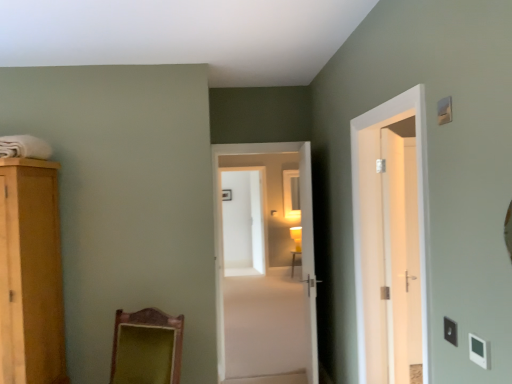
This screenshot has height=384, width=512. Describe the element at coordinates (293, 261) in the screenshot. I see `matte wooden table at center` at that location.

The width and height of the screenshot is (512, 384). I want to click on matte wooden table at center, so click(293, 261).

Describe the element at coordinates (291, 194) in the screenshot. This screenshot has width=512, height=384. I see `matte glass mirror at center` at that location.

You are a GUI agent. You are given a task and a screenshot of the screen. Output one action in this format:
    pyautogui.click(x=<x>, y=<y>)
    Task: Click on the white glossy screen door at center
    Image resolution: width=512 pixels, height=384 pixels.
    Given the screenshot: What is the action you would take?
    pyautogui.click(x=244, y=221)

Where is `white glossy door at upper right, positioned as the first door in front-to-back order`? The width and height of the screenshot is (512, 384). white glossy door at upper right, positioned as the first door in front-to-back order is located at coordinates (418, 198).

Locate an element on the screen. matte wooden table at center is located at coordinates (293, 261).

Would you say white fabric at upper left is inside or outside white plastic light switch at lower right, which ranks as the 3th light switch in back-to-front order?

white fabric at upper left lies outside white plastic light switch at lower right, which ranks as the 3th light switch in back-to-front order.

Would you consider white fabric at upper left to be distant from white plastic light switch at lower right, positioned as the 1th light switch in front-to-back order?

Yes, white fabric at upper left is far from white plastic light switch at lower right, positioned as the 1th light switch in front-to-back order.

Considering the relative sizes of white fabric at upper left and white plastic light switch at lower right, acting as the third light switch starting from the top, in the image provided, is white fabric at upper left wider than white plastic light switch at lower right, acting as the third light switch starting from the top,?

Indeed, white fabric at upper left has a greater width compared to white plastic light switch at lower right, acting as the third light switch starting from the top.

Based on the photo, is matte wooden table at center positioned behind white fabric at upper left?

Yes, matte wooden table at center is further from the camera.

Locate an element on the screen. This screenshot has height=384, width=512. table lying below the white fabric at upper left (from the image's perspective) is located at coordinates (293, 261).

Looking at this image, from the image's perspective, is matte wooden table at center above or below white fabric at upper left?

Clearly, from the image's perspective, matte wooden table at center is below white fabric at upper left.

Is white fabric at upper left at the back of matte wooden table at center?

No, white fabric at upper left is not at the back of matte wooden table at center.

Considering the relative positions of matte glass mirror at center and white fabric at upper left in the image provided, is matte glass mirror at center to the left or to the right of white fabric at upper left?

Based on their positions, matte glass mirror at center is located to the right of white fabric at upper left.

Can white fabric at upper left be found inside matte glass mirror at center?

No.

Between matte glass mirror at center and white fabric at upper left, which one has more height?

matte glass mirror at center.

Is matte glass mirror at center not close to white fabric at upper left?

Indeed, matte glass mirror at center is not near white fabric at upper left.

From a real-world perspective, which is physically above, white fabric at upper left or white glossy door at center, the third door when ordered from front to back?

In real-world perspective, white fabric at upper left is above.

Is white fabric at upper left positioned with its back to white glossy door at center, the third door when ordered from front to back?

No, white fabric at upper left's orientation is not away from white glossy door at center, the third door when ordered from front to back.

Which object is thinner, white fabric at upper left or white glossy door at center, the third door when ordered from front to back?

With smaller width is white glossy door at center, the third door when ordered from front to back.

Would you consider white fabric at upper left to be distant from white glossy door at center, the 1th door when ordered from left to right?

Yes.

Does point (283, 176) come closer to viewer compared to point (445, 107)?

That is False.

Considering the sizes of objects matte glass mirror at center and white plastic light switch at upper right, marked as the third light switch in a bottom-to-top arrangement, in the image provided, who is smaller, matte glass mirror at center or white plastic light switch at upper right, marked as the third light switch in a bottom-to-top arrangement,?

white plastic light switch at upper right, marked as the third light switch in a bottom-to-top arrangement.

Considering the relative positions of matte glass mirror at center and white plastic light switch at upper right, positioned as the second light switch in back-to-front order, in the image provided, is matte glass mirror at center to the left of white plastic light switch at upper right, positioned as the second light switch in back-to-front order, from the viewer's perspective?

No.

Does matte glass mirror at center come behind white plastic light switch at upper right, which is the first light switch in top-to-bottom order?

That is True.

Is white glossy door at upper right, positioned as the first door in front-to-back order, facing away from white glossy door at center, the third door when ordered from front to back?

white glossy door at upper right, positioned as the first door in front-to-back order, is not turned away from white glossy door at center, the third door when ordered from front to back.

From the image's perspective, is white glossy door at upper right, which is the 4th door from back to front, positioned above or below white glossy door at center, which is the fourth door from right to left?

white glossy door at upper right, which is the 4th door from back to front, is above white glossy door at center, which is the fourth door from right to left.

Looking at this image, is white glossy door at upper right, positioned as the first door in front-to-back order, not inside white glossy door at center, the third door when ordered from front to back?

Yes, white glossy door at upper right, positioned as the first door in front-to-back order, is outside of white glossy door at center, the third door when ordered from front to back.

Is white glossy door at upper right, which is the second door in right-to-left order, not near white glossy door at center, the 1th door when ordered from left to right?

That's right, there is a large distance between white glossy door at upper right, which is the second door in right-to-left order, and white glossy door at center, the 1th door when ordered from left to right.

Who is taller, white glossy screen door at center or white plastic light switch at upper right, which ranks as the second light switch in front-to-back order?

With more height is white glossy screen door at center.

Is white glossy screen door at center further to the viewer compared to white plastic light switch at upper right, which ranks as the second light switch in front-to-back order?

Yes, white glossy screen door at center is behind white plastic light switch at upper right, which ranks as the second light switch in front-to-back order.

Does white glossy screen door at center turn towards white plastic light switch at upper right, which ranks as the second light switch in front-to-back order?

Yes, white glossy screen door at center is oriented towards white plastic light switch at upper right, which ranks as the second light switch in front-to-back order.

Considering the relative positions of white glossy screen door at center and white plastic light switch at upper right, which is the first light switch in top-to-bottom order, in the image provided, is white glossy screen door at center to the left of white plastic light switch at upper right, which is the first light switch in top-to-bottom order, from the viewer's perspective?

Indeed, white glossy screen door at center is positioned on the left side of white plastic light switch at upper right, which is the first light switch in top-to-bottom order.

From the white fabric at upper left, count 3rd light switchs forward and point to it. Please provide its 2D coordinates.

[(479, 351)]

Where is `laundry that is on the left side of matte wooden table at center`? laundry that is on the left side of matte wooden table at center is located at coordinates (24, 147).

Based on their spatial positions, is white glossy door at center, which is the fourth door from right to left, or white glossy screen door at center further from white plastic light switch at lower right, arranged as the 1th light switch when ordered from the bottom?

white glossy screen door at center.

Considering their positions, is matte glass mirror at center positioned closer to white glossy door at upper right, marked as the third door in a left-to-right arrangement, than white plastic light switch at lower right, arranged as the 1th light switch when ordered from the bottom?

Among the two, white plastic light switch at lower right, arranged as the 1th light switch when ordered from the bottom, is located nearer to white glossy door at upper right, marked as the third door in a left-to-right arrangement.

Which object lies nearer to the anchor point white glossy door at upper right, positioned as the first door in front-to-back order, white fabric at upper left or white glossy door at right, acting as the fourth door starting from the left?

white glossy door at right, acting as the fourth door starting from the left, is positioned closer to the anchor white glossy door at upper right, positioned as the first door in front-to-back order.

Looking at the image, which one is located closer to matte glass mirror at center, white glossy door at center, the third door when ordered from front to back, or white glossy door at center, the second door positioned from the front?

The object closer to matte glass mirror at center is white glossy door at center, the second door positioned from the front.

Consider the image. Based on their spatial positions, is white plastic light switch at lower right, which ranks as the 3th light switch in back-to-front order, or white glossy door at right, marked as the 1th door in a right-to-left arrangement, closer to matte wooden table at center?

white glossy door at right, marked as the 1th door in a right-to-left arrangement, is closer to matte wooden table at center.

When comparing their distances from white glossy door at right, arranged as the fourth door when viewed from the front, does white plastic light switch at lower right, positioned as the 1th light switch in front-to-back order, or white fabric at upper left seem further?

white fabric at upper left is further to white glossy door at right, arranged as the fourth door when viewed from the front.

From the image, which object appears to be farther from white glossy screen door at center, white glossy door at upper right, which is the 4th door from back to front, or matte glass mirror at center?

white glossy door at upper right, which is the 4th door from back to front.

Based on their spatial positions, is white glossy door at right, arranged as the first door when viewed from the back, or white plastic light switch at lower right, acting as the third light switch starting from the top, closer to white plastic light switch at upper right, marked as the third light switch in a bottom-to-top arrangement?

white plastic light switch at lower right, acting as the third light switch starting from the top, is closer to white plastic light switch at upper right, marked as the third light switch in a bottom-to-top arrangement.

The width and height of the screenshot is (512, 384). Find the location of `door between white plastic light switch at lower right, positioned as the 1th light switch in front-to-back order, and white glossy door at center, which ranks as the 3th door in right-to-left order, along the z-axis`. door between white plastic light switch at lower right, positioned as the 1th light switch in front-to-back order, and white glossy door at center, which ranks as the 3th door in right-to-left order, along the z-axis is located at coordinates (x=418, y=198).

Where is `table positioned between white glossy door at center, which ranks as the 3th door in right-to-left order, and matte yellow lampshade at center from near to far`? The width and height of the screenshot is (512, 384). table positioned between white glossy door at center, which ranks as the 3th door in right-to-left order, and matte yellow lampshade at center from near to far is located at coordinates (293, 261).

Identify the location of laundry positioned between white plastic light switch at lower right, the 3th light switch when ordered from front to back, and matte yellow lampshade at center from near to far. The height and width of the screenshot is (384, 512). (24, 147).

You are a GUI agent. You are given a task and a screenshot of the screen. Output one action in this format:
    pyautogui.click(x=<x>, y=<y>)
    Task: Click on the laundry between white plastic light switch at upper right, marked as the third light switch in a bottom-to-top arrangement, and white glossy door at center, the 1th door when ordered from left to right, from front to back
    This screenshot has width=512, height=384.
    Given the screenshot: What is the action you would take?
    pyautogui.click(x=24, y=147)